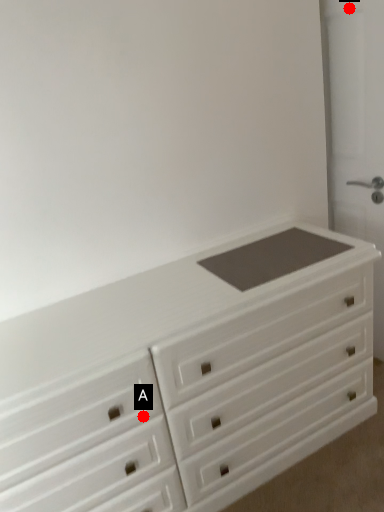
Question: Two points are circled on the image, labeled by A and B beside each circle. Among these points, which one is nearest to the camera?

Choices:
 (A) A is closer
 (B) B is closer

Answer: (A)